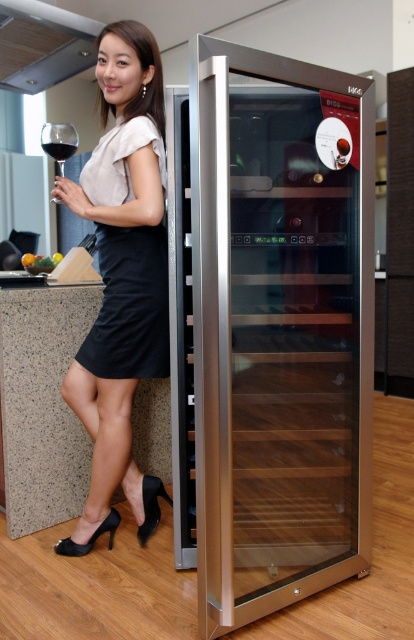
Question: Where is satin silver wine cooler at right located in relation to transparent glass wine glass at left in the image?

Choices:
 (A) right
 (B) left

Answer: (A)

Question: Which object appears closest to the camera in this image?

Choices:
 (A) transparent glass wine glass at left
 (B) black satin dress at left

Answer: (B)

Question: Which object is the closest to the dark red liquid at upper left?

Choices:
 (A) green leafy vegetables at left
 (B) satin silver wine cooler at right

Answer: (A)

Question: From the image, what is the correct spatial relationship of transparent glass wine glass at left in relation to dark red liquid at upper left?

Choices:
 (A) above
 (B) below

Answer: (A)

Question: Estimate the real-world distances between objects in this image. Which object is farther from the transparent glass wine glass at left?

Choices:
 (A) black satin dress at left
 (B) satin silver wine cooler at right
 (C) green leafy vegetables at left
 (D) matte black dress at left

Answer: (B)

Question: From the image, what is the correct spatial relationship of matte black dress at left in relation to black satin dress at left?

Choices:
 (A) below
 (B) above

Answer: (A)